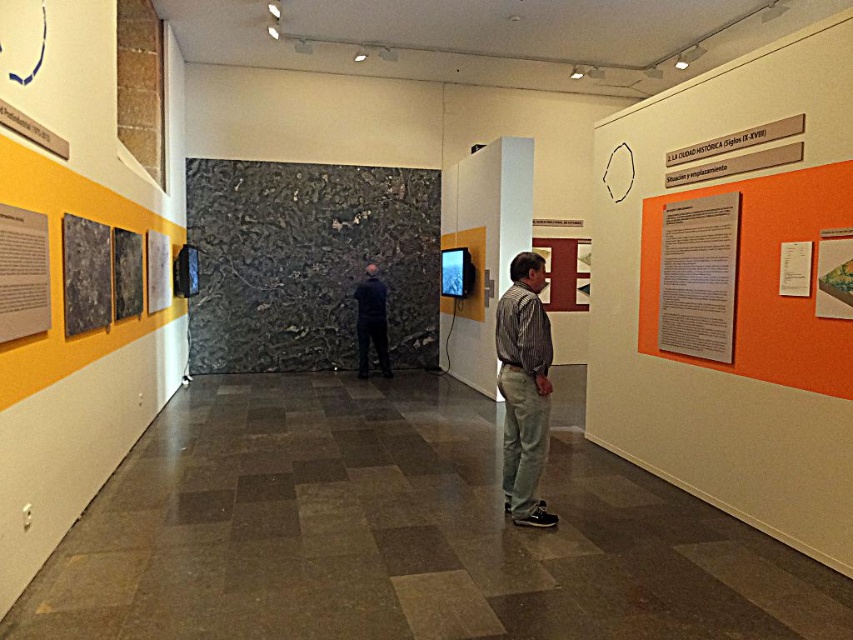
Question: Which of the following is the farthest from the observer?

Choices:
 (A) black textured wall at center
 (B) striped cotton shirt at center
 (C) dark blue fabric at center
 (D) matte paper poster at left

Answer: (A)

Question: Among these points, which one is farthest from the camera?

Choices:
 (A) tap(42, 269)
 (B) tap(827, 291)
 (C) tap(358, 301)

Answer: (C)

Question: Is black textured wall at center below matte paper poster at left?

Choices:
 (A) no
 (B) yes

Answer: (A)

Question: Does striped cotton shirt at center appear on the left side of matte paper poster at left?

Choices:
 (A) no
 (B) yes

Answer: (A)

Question: Can you confirm if black textured wall at center is positioned to the left of matte paper poster at left?

Choices:
 (A) no
 (B) yes

Answer: (A)

Question: Estimate the real-world distances between objects in this image. Which object is closer to the matte paper poster at left?

Choices:
 (A) striped cotton shirt at center
 (B) white paper at right

Answer: (A)